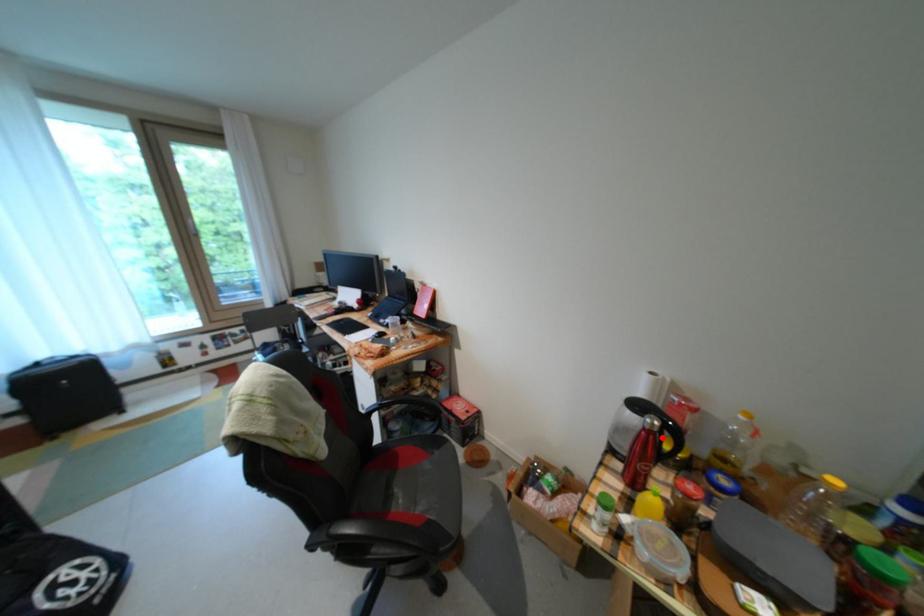
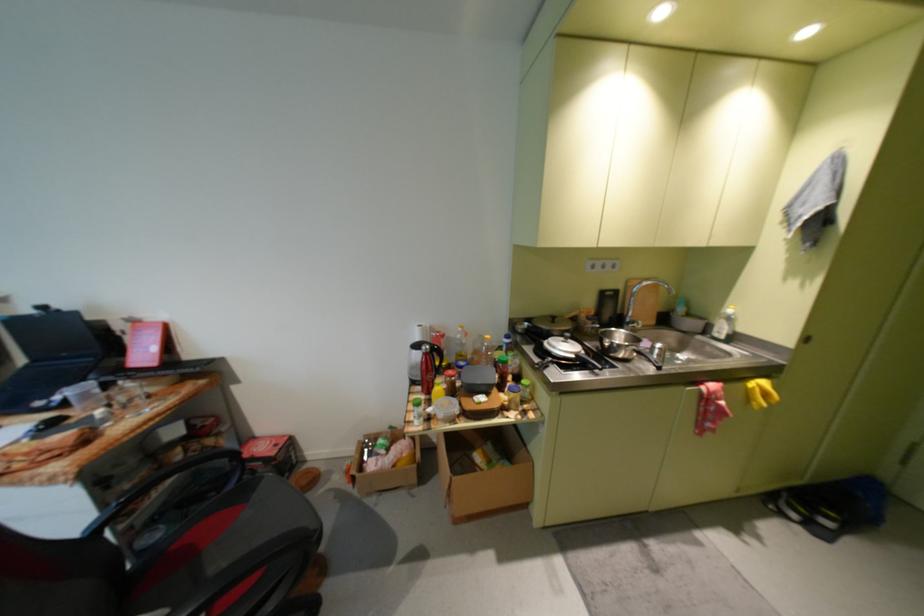
Where in the second image is the point corresponding to the highlighted location from the first image?

(439, 358)